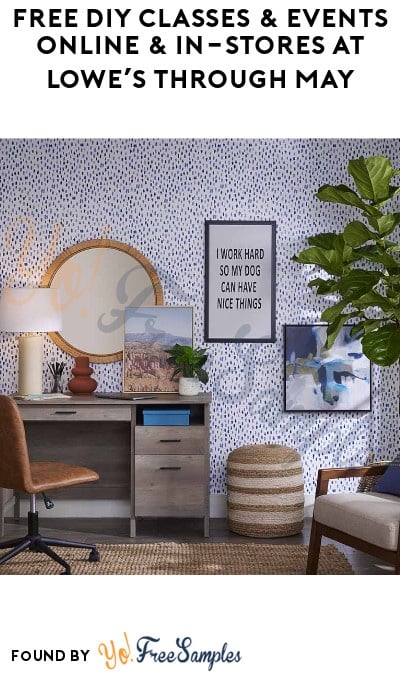
Identify the location of desk. This screenshot has width=400, height=675. (96, 398).